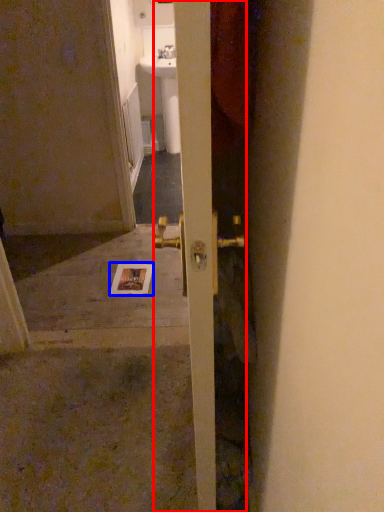
Question: Which point is closer to the camera, door (highlighted by a red box) or postcard (highlighted by a blue box)?

Choices:
 (A) door
 (B) postcard

Answer: (A)